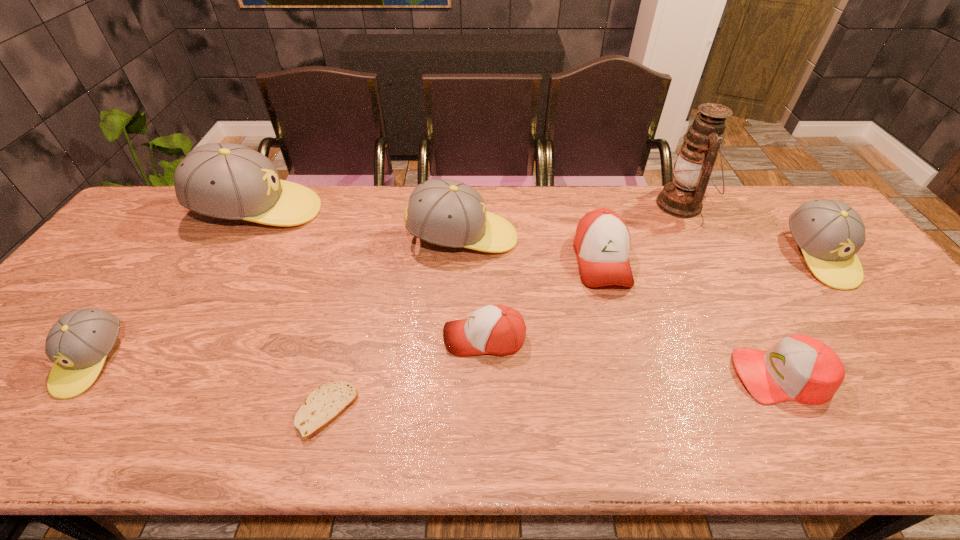
This screenshot has height=540, width=960. In order to click on vacant point located 0.100m on the front-facing side of the nearest yellow baseball cap in this screenshot , I will do `click(31, 444)`.

Find the location of `free point located 0.110m on the front-facing side of the smaller orange baseball cap`. free point located 0.110m on the front-facing side of the smaller orange baseball cap is located at coordinates (398, 339).

Where is `vacant space situated on the front-facing side of the smaller orange baseball cap`? The height and width of the screenshot is (540, 960). vacant space situated on the front-facing side of the smaller orange baseball cap is located at coordinates (420, 339).

Identify the location of vacant space positioned on the front-facing side of the smaller orange baseball cap. (345, 339).

I want to click on free space located on the front-facing side of the second baseball cap from right to left, so click(571, 375).

Locate an element on the screen. The height and width of the screenshot is (540, 960). free space located on the front-facing side of the second baseball cap from right to left is located at coordinates (576, 375).

Locate an element on the screen. The width and height of the screenshot is (960, 540). blank space located on the front-facing side of the second baseball cap from right to left is located at coordinates (660, 375).

Where is `free region located on the back of the pita bread`? This screenshot has height=540, width=960. free region located on the back of the pita bread is located at coordinates [x=361, y=280].

Where is `lantern that is positioned at the far edge`? The width and height of the screenshot is (960, 540). lantern that is positioned at the far edge is located at coordinates (683, 197).

Locate an element on the screen. This screenshot has height=540, width=960. object that is at the near edge is located at coordinates (324, 405).